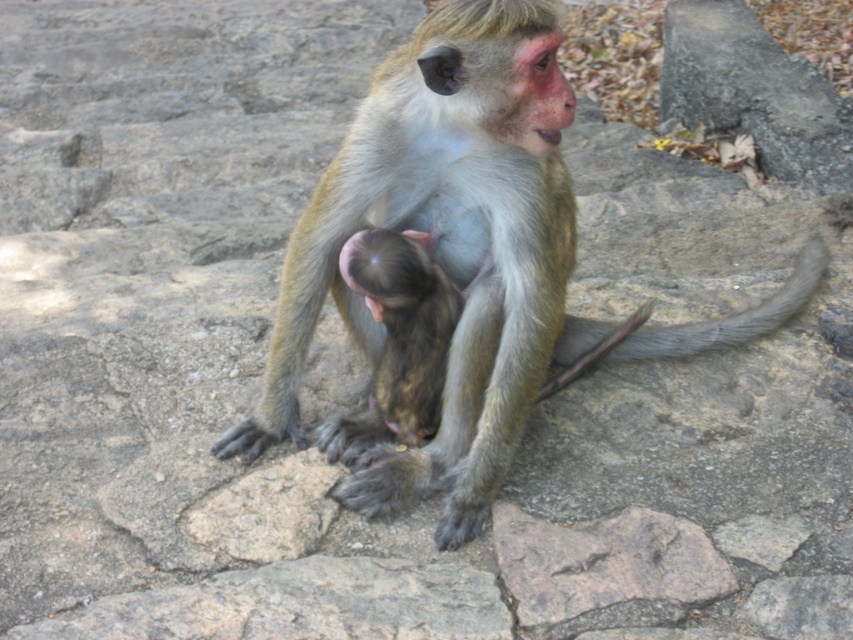
You are a researcher studying the behavior of monkeys in their natural habitat. You observe a monkey sitting on a stone surface and notice a specific point at coordinates (445, 248). Based on the scene, can you determine which part of the monkey this point corresponds to?

The point at coordinates (445, 248) is located on the green fur monkey at center, which is the adult macaque. This suggests the point is on the adult monkey, possibly near its chest where the baby monkey is nestled.

You are a wildlife photographer trying to capture a clear photo of both the green fur monkey at center and the soft fur monkey at center. Given that your camera has a depth of field that can focus on objects within a 4 inch range, will you be able to get both monkeys in focus at the same time?

The green fur monkey at center is 5.03 inches away from the soft fur monkey at center. Since the distance between them exceeds the camera lens depth of field range of 4 inches, it will be challenging to have both monkeys in focus simultaneously in the photo.